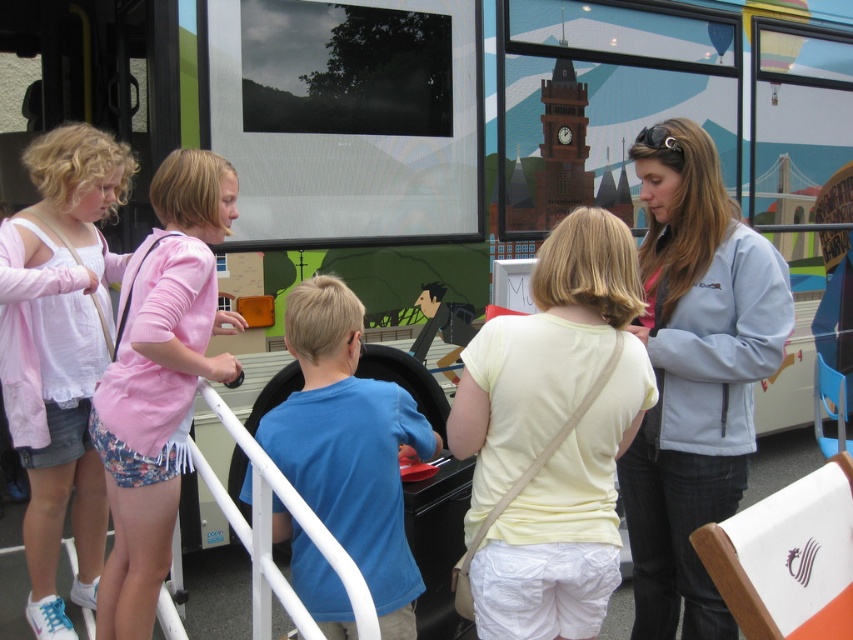
Question: Does light blue softshell jacket at upper right lie in front of pink fabric shorts at left?

Choices:
 (A) yes
 (B) no

Answer: (B)

Question: Estimate the real-world distances between objects in this image. Which object is closer to the light yellow t-shirt at center?

Choices:
 (A) light blue softshell jacket at upper right
 (B) pink fabric shorts at left
 (C) blue cotton shirt at center

Answer: (C)

Question: Is light yellow t-shirt at center to the right of light blue softshell jacket at upper right from the viewer's perspective?

Choices:
 (A) yes
 (B) no

Answer: (B)

Question: Does pink fabric shorts at left appear on the left side of blue cotton shirt at center?

Choices:
 (A) yes
 (B) no

Answer: (A)

Question: Which point is farther to the camera?

Choices:
 (A) blue cotton shirt at center
 (B) light yellow t-shirt at center
 (C) light blue softshell jacket at upper right
 (D) pink fabric shorts at left

Answer: (C)

Question: Which of the following is the closest to the observer?

Choices:
 (A) (704, 461)
 (B) (314, 588)
 (C) (149, 440)

Answer: (B)